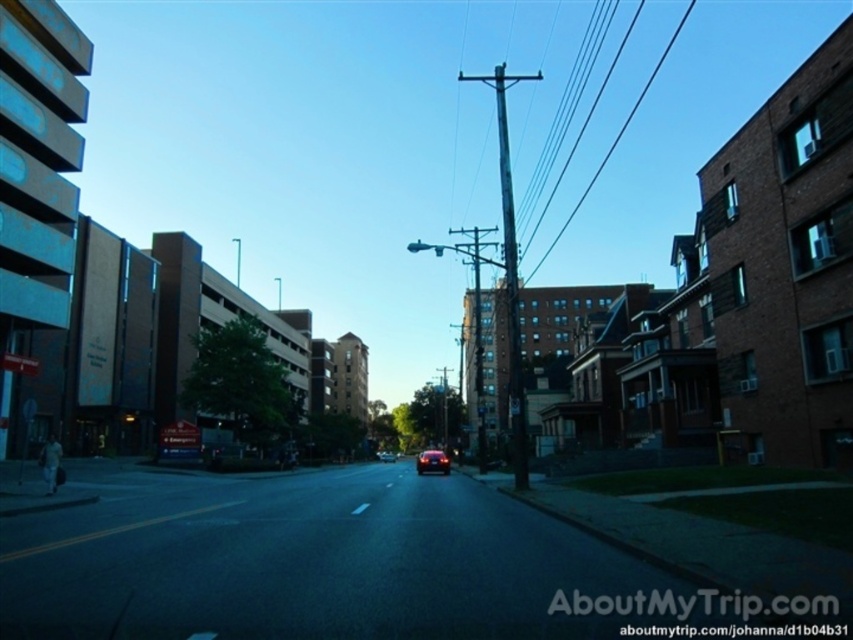
Question: Does metallic wire at center have a greater width compared to shiny silver sedan at center?

Choices:
 (A) yes
 (B) no

Answer: (A)

Question: Which object is the closest to the shiny silver sedan at center?

Choices:
 (A) glossy black car at center
 (B) weathered wood telegraph pole at center
 (C) metallic wire at center

Answer: (A)

Question: Which of the following is the farthest from the observer?

Choices:
 (A) glossy black car at center
 (B) weathered wood telegraph pole at center

Answer: (A)

Question: Which of the following is the closest to the observer?

Choices:
 (A) (598, 170)
 (B) (514, 384)
 (C) (386, 458)
 (D) (439, 451)

Answer: (B)

Question: Observing the image, what is the correct spatial positioning of weathered wood telegraph pole at center in reference to metallic wire at center?

Choices:
 (A) below
 (B) above

Answer: (A)

Question: Does weathered wood telegraph pole at center appear on the left side of metallic wire at center?

Choices:
 (A) no
 (B) yes

Answer: (B)